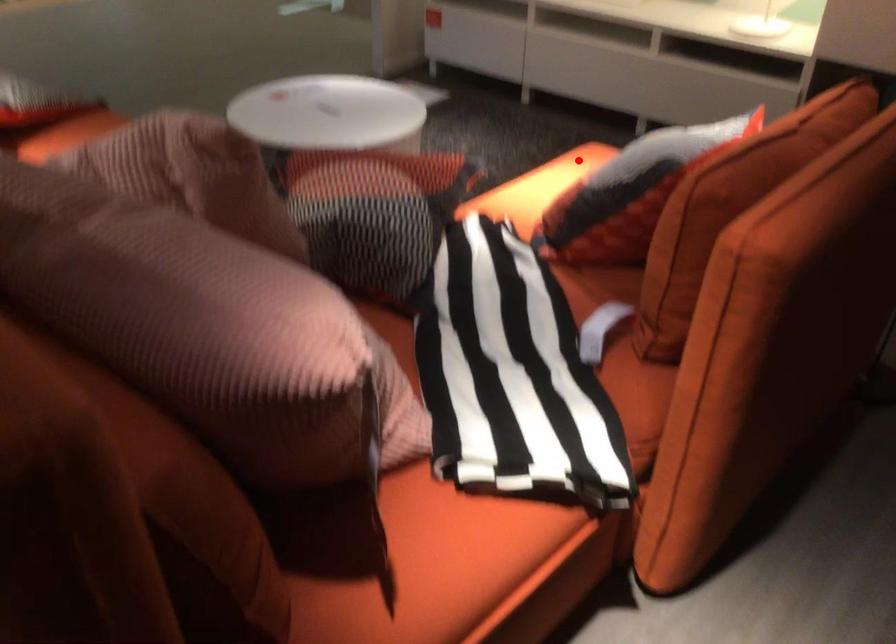
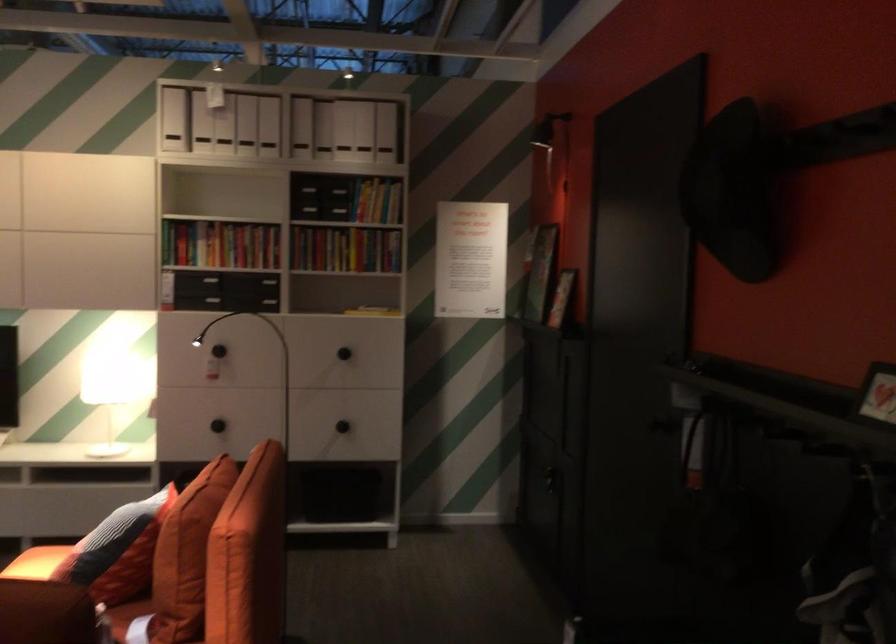
Locate, in the second image, the point that corresponds to the highlighted location in the first image.

(36, 563)